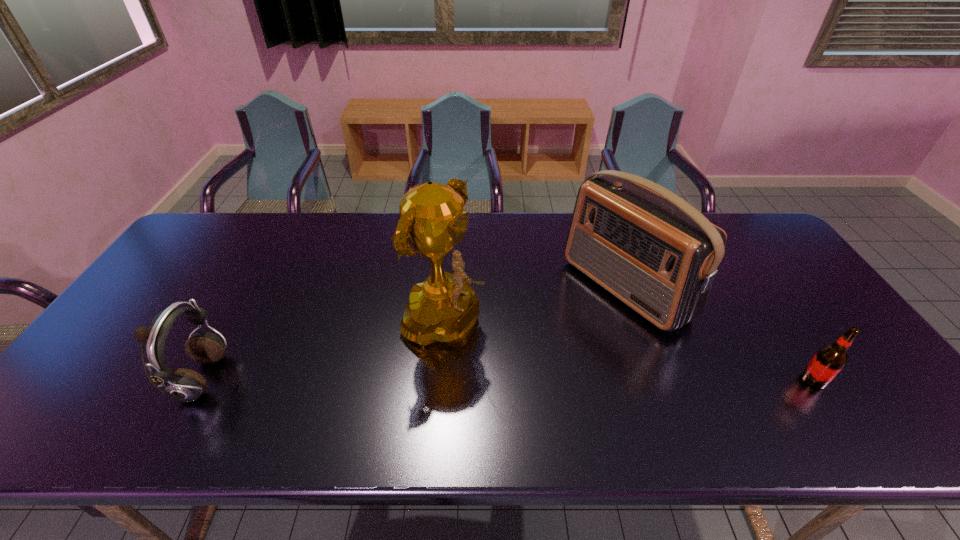
Locate an element on the screen. The image size is (960, 540). object that is positioned at the near right corner is located at coordinates (830, 359).

In the image, there is a desktop. Where is `vacant space at the far edge`? This screenshot has height=540, width=960. vacant space at the far edge is located at coordinates (265, 245).

This screenshot has width=960, height=540. I want to click on free space at the near edge of the desktop, so click(707, 399).

Where is `vacant space at the left edge of the desktop`? The width and height of the screenshot is (960, 540). vacant space at the left edge of the desktop is located at coordinates (208, 271).

The height and width of the screenshot is (540, 960). I want to click on vacant space at the near left corner of the desktop, so click(60, 402).

Identify the location of vacant region at the far right corner of the desktop. (740, 252).

In the image, there is a desktop. Where is `free space at the near right corner`? free space at the near right corner is located at coordinates (856, 396).

Where is `free area in between the second object from left to right and the rightmost object`? free area in between the second object from left to right and the rightmost object is located at coordinates (629, 352).

This screenshot has height=540, width=960. In order to click on vacant area that lies between the award and the rightmost object in this screenshot , I will do `click(629, 352)`.

Locate an element on the screen. This screenshot has width=960, height=540. free space between the award and the second shortest object is located at coordinates (323, 352).